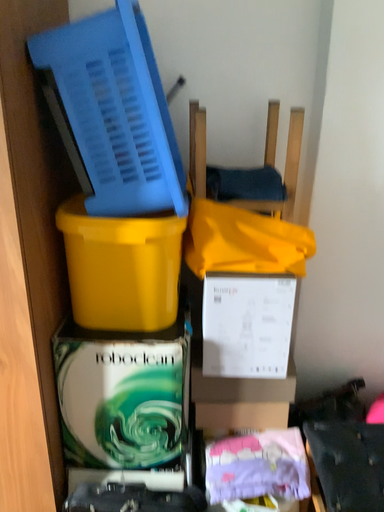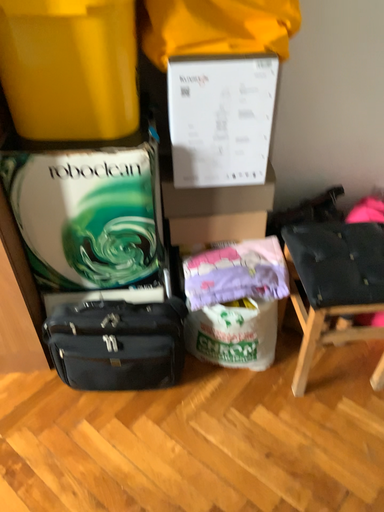
Question: How did the camera likely rotate when shooting the video?

Choices:
 (A) rotated upward
 (B) rotated downward

Answer: (B)